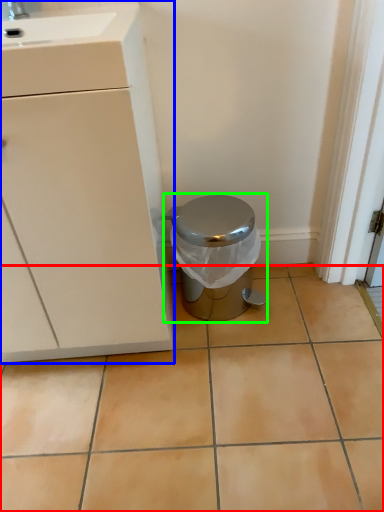
Question: Which is farther away from ceramic tile (highlighted by a red box)? cabinetry (highlighted by a blue box) or waste container (highlighted by a green box)?

Choices:
 (A) cabinetry
 (B) waste container

Answer: (A)